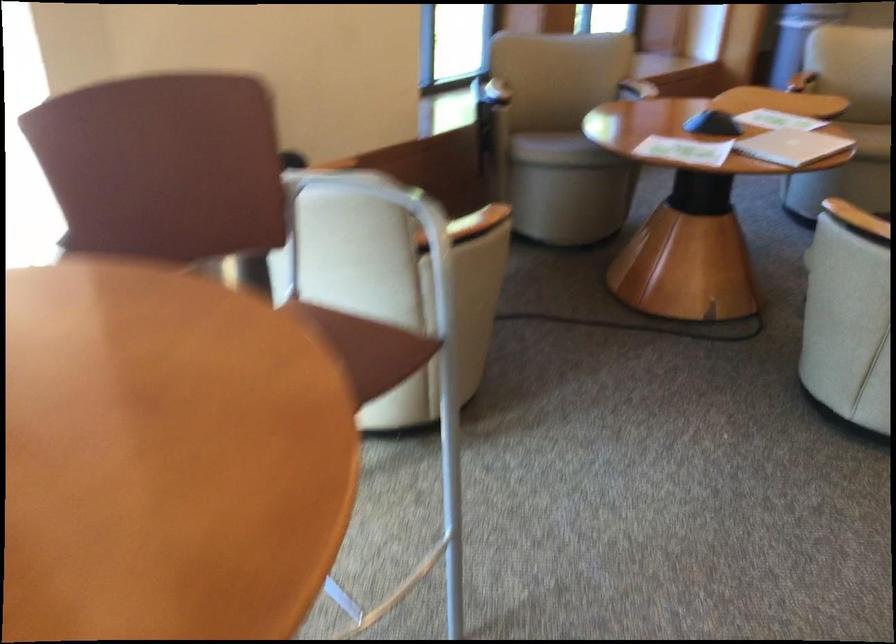
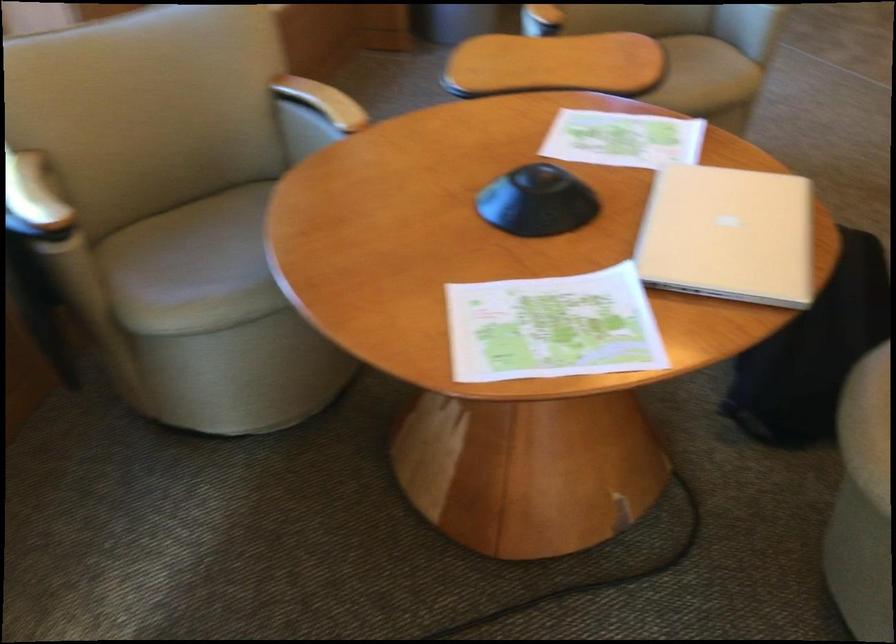
The point at [705,145] is marked in the first image. Where is the corresponding point in the second image?

(552, 327)